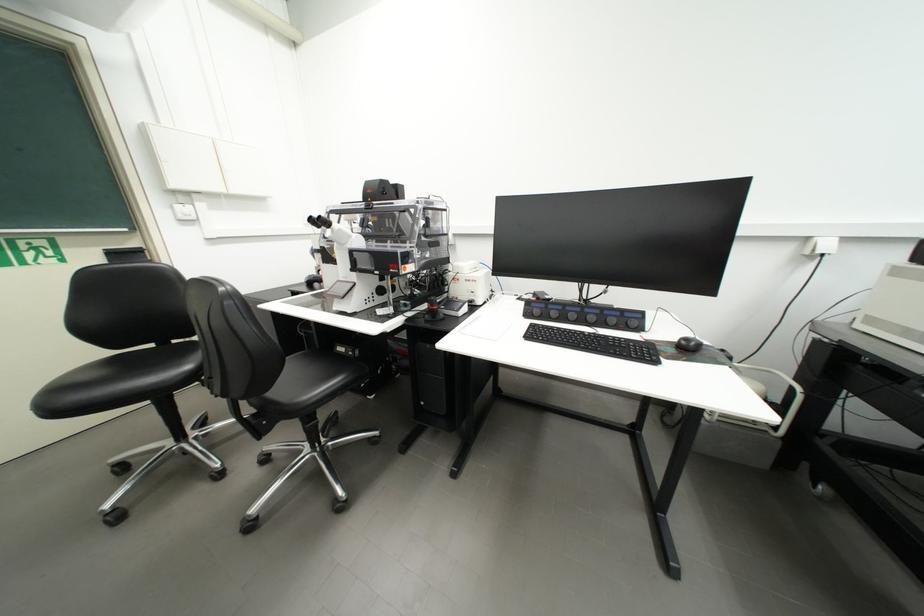
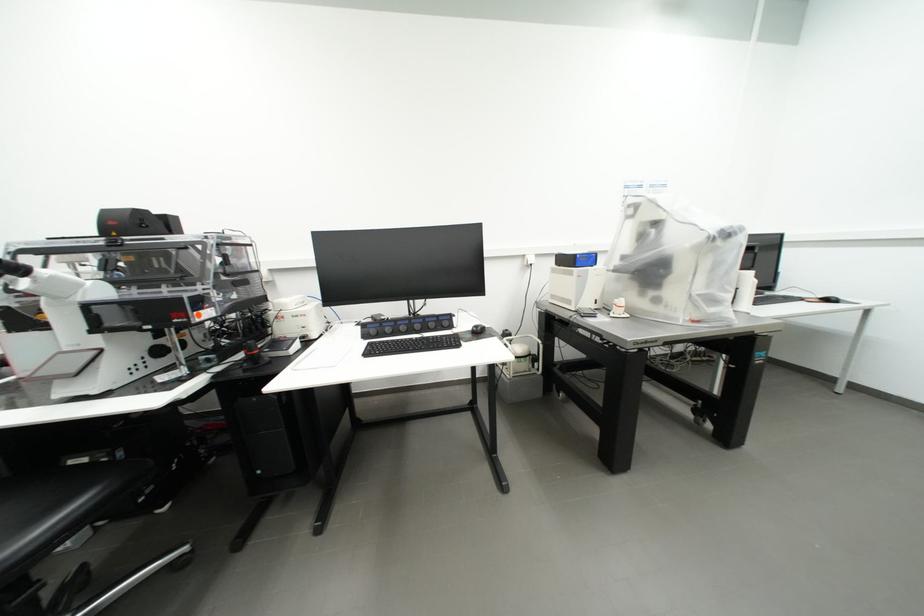
Question: The camera is either moving clockwise (left) or counter-clockwise (right) around the object. The first image is from the beginning of the video and the second image is from the end. Is the camera moving left or right when shooting the video?

Choices:
 (A) Left
 (B) Right

Answer: (A)